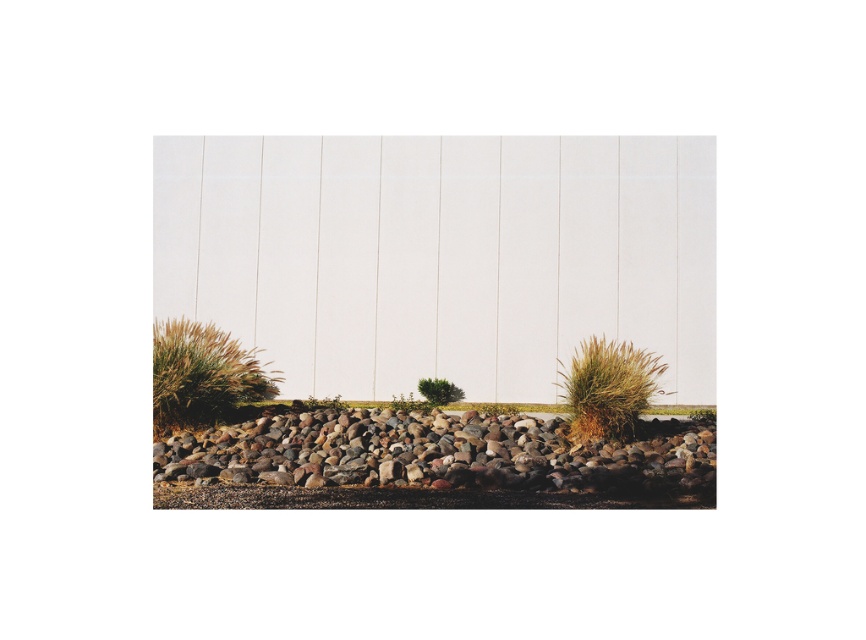
Question: In this image, where is brown grass at lower left located relative to green leafy bush at center?

Choices:
 (A) right
 (B) left

Answer: (B)

Question: Which object appears farthest from the camera in this image?

Choices:
 (A) brown fuzzy bush at lower right
 (B) green leafy bush at center
 (C) smooth brown stones at center
 (D) brown grass at lower left

Answer: (B)

Question: Which point appears farthest from the camera in this image?

Choices:
 (A) (612, 428)
 (B) (456, 397)
 (C) (199, 339)
 (D) (308, 499)

Answer: (B)

Question: Does brown grass at lower left appear on the right side of green leafy bush at center?

Choices:
 (A) no
 (B) yes

Answer: (A)

Question: Which point appears closest to the camera in this image?

Choices:
 (A) (183, 417)
 (B) (440, 387)
 (C) (632, 372)

Answer: (C)

Question: From the image, what is the correct spatial relationship of brown grass at lower left in relation to brown fuzzy bush at lower right?

Choices:
 (A) above
 (B) below

Answer: (A)